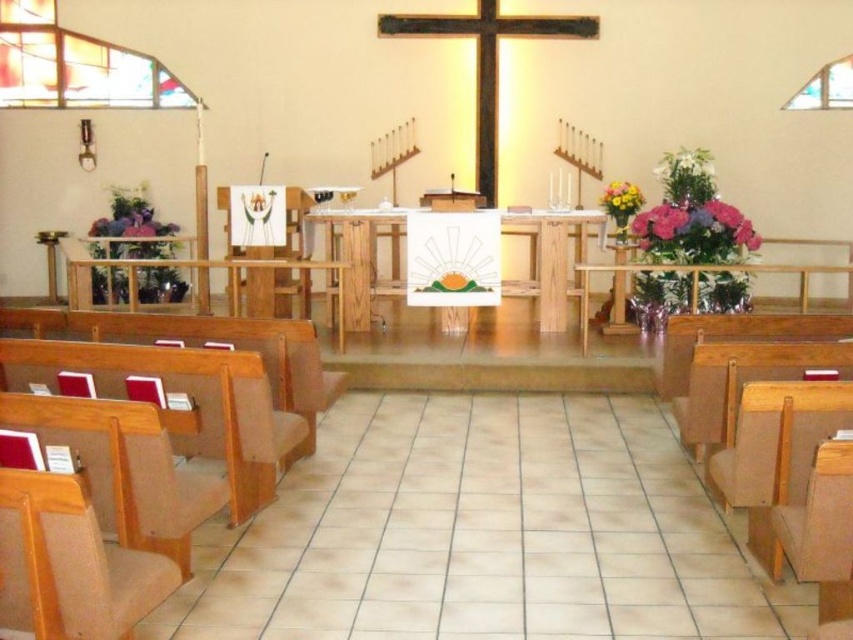
You are standing at the entrance of the church and want to sit down. You see the brown leather chair at right and the light brown wood chair at lower left. Which chair is higher up in the image?

The brown leather chair at right is located above the light brown wood chair at lower left in the image.

You are a visitor entering the church and need to sit down. There is a light brown wood chair at lower left and a wooden cross at center. Which object should you approach if you want to sit?

The light brown wood chair at lower left is the object you can sit on, as the wooden cross at center is likely a symbolic or decorative item and not meant for sitting.

Based on the photo, you are a visitor standing at the entrance of the church and want to sit down. You see the light brown wood chair at lower left and the wooden cross at center. Which object is shorter and therefore suitable for sitting?

The light brown wood chair at lower left is shorter than the wooden cross at center, so it is suitable for sitting.